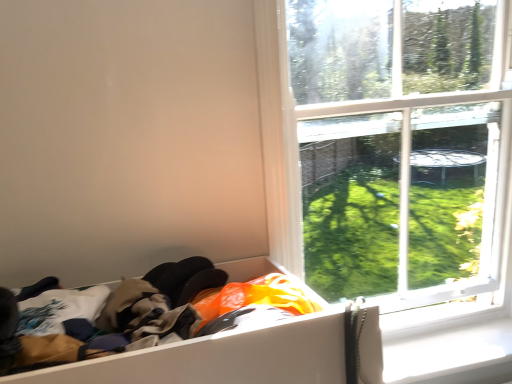
Question: From a real-world perspective, is white cardboard box at lower left on top of transparent glass window at upper right?

Choices:
 (A) yes
 (B) no

Answer: (B)

Question: Can transparent glass window at upper right be found inside white cardboard box at lower left?

Choices:
 (A) no
 (B) yes

Answer: (A)

Question: Can you confirm if white cardboard box at lower left is smaller than transparent glass window at upper right?

Choices:
 (A) no
 (B) yes

Answer: (A)

Question: Is white cardboard box at lower left further to camera compared to transparent glass window at upper right?

Choices:
 (A) no
 (B) yes

Answer: (A)

Question: Can you confirm if white cardboard box at lower left is thinner than transparent glass window at upper right?

Choices:
 (A) no
 (B) yes

Answer: (A)

Question: From their relative heights in the image, would you say transparent glass window at upper right is taller or shorter than white cardboard box at lower left?

Choices:
 (A) tall
 (B) short

Answer: (A)

Question: Choose the correct answer: Is transparent glass window at upper right inside white cardboard box at lower left or outside it?

Choices:
 (A) inside
 (B) outside

Answer: (B)

Question: From a real-world perspective, is transparent glass window at upper right positioned above or below white cardboard box at lower left?

Choices:
 (A) below
 (B) above

Answer: (B)

Question: Considering the positions of point (382, 72) and point (329, 337), is point (382, 72) closer or farther from the camera than point (329, 337)?

Choices:
 (A) closer
 (B) farther

Answer: (B)

Question: Is point (199, 369) closer or farther from the camera than point (410, 349)?

Choices:
 (A) closer
 (B) farther

Answer: (A)

Question: In terms of height, does white cardboard box at lower left look taller or shorter compared to white plastic window sill at lower right?

Choices:
 (A) tall
 (B) short

Answer: (A)

Question: Considering the relative positions of white cardboard box at lower left and white plastic window sill at lower right in the image provided, is white cardboard box at lower left to the left or to the right of white plastic window sill at lower right?

Choices:
 (A) right
 (B) left

Answer: (B)

Question: From the image's perspective, is white cardboard box at lower left positioned above or below white plastic window sill at lower right?

Choices:
 (A) above
 (B) below

Answer: (A)

Question: Is white cardboard box at lower left bigger or smaller than transparent glass window at upper right?

Choices:
 (A) small
 (B) big

Answer: (B)

Question: Is white cardboard box at lower left wider or thinner than transparent glass window at upper right?

Choices:
 (A) wide
 (B) thin

Answer: (A)